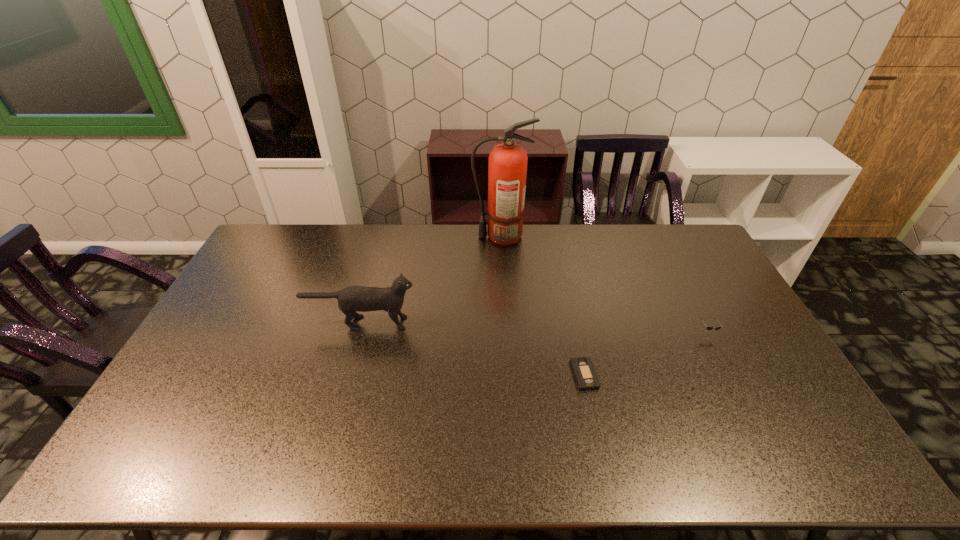
The width and height of the screenshot is (960, 540). I want to click on fire extinguisher, so click(507, 164).

Identify the location of the farthest object. This screenshot has height=540, width=960. (507, 164).

The width and height of the screenshot is (960, 540). Identify the location of cat. (355, 298).

This screenshot has width=960, height=540. Find the location of `the leftmost object`. the leftmost object is located at coordinates (355, 298).

This screenshot has height=540, width=960. In order to click on sunglasses in this screenshot , I will do `click(708, 327)`.

The image size is (960, 540). I want to click on the rightmost object, so click(708, 327).

Locate an element on the screen. videotape is located at coordinates (584, 372).

Find the location of a particular element. The height and width of the screenshot is (540, 960). the nearest object is located at coordinates (584, 372).

Locate an element on the screen. The height and width of the screenshot is (540, 960). vacant area located 0.200m on the nozzle of the farthest object is located at coordinates (421, 237).

Where is `vacant space located on the nozzle of the farthest object`? The height and width of the screenshot is (540, 960). vacant space located on the nozzle of the farthest object is located at coordinates (457, 237).